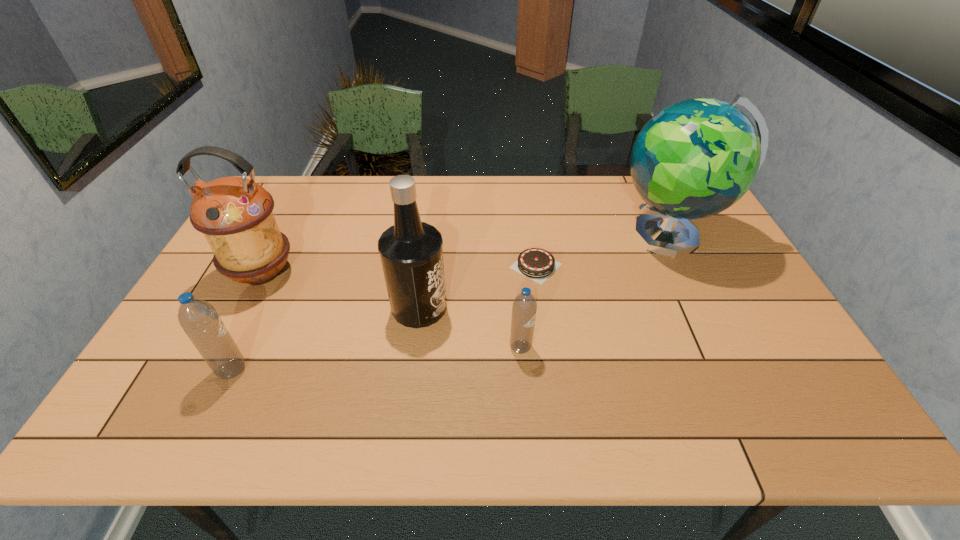
I want to click on object positioned at the right edge, so click(695, 158).

I want to click on object that is positioned at the near left corner, so pos(198,318).

Where is `object at the far right corner`? object at the far right corner is located at coordinates (695, 158).

Locate an element on the screen. This screenshot has height=540, width=960. vacant space at the far edge of the desktop is located at coordinates (608, 201).

In the image, there is a desktop. Where is `vacant space at the near edge`? vacant space at the near edge is located at coordinates (646, 375).

At what (x,y) coordinates should I click in order to perform the action: click on free space at the left edge of the desktop. Please return your answer as a coordinate pair (x, y). Looking at the image, I should click on (203, 290).

Locate an element on the screen. Image resolution: width=960 pixels, height=540 pixels. free location at the far left corner of the desktop is located at coordinates (292, 179).

Locate an element on the screen. The image size is (960, 540). free space between the globe and the oil lamp is located at coordinates (466, 255).

Locate an element on the screen. The image size is (960, 540). unoccupied area between the shortest object and the left water bottle is located at coordinates (384, 318).

Image resolution: width=960 pixels, height=540 pixels. I want to click on unoccupied position between the left water bottle and the oil lamp, so pyautogui.click(x=247, y=321).